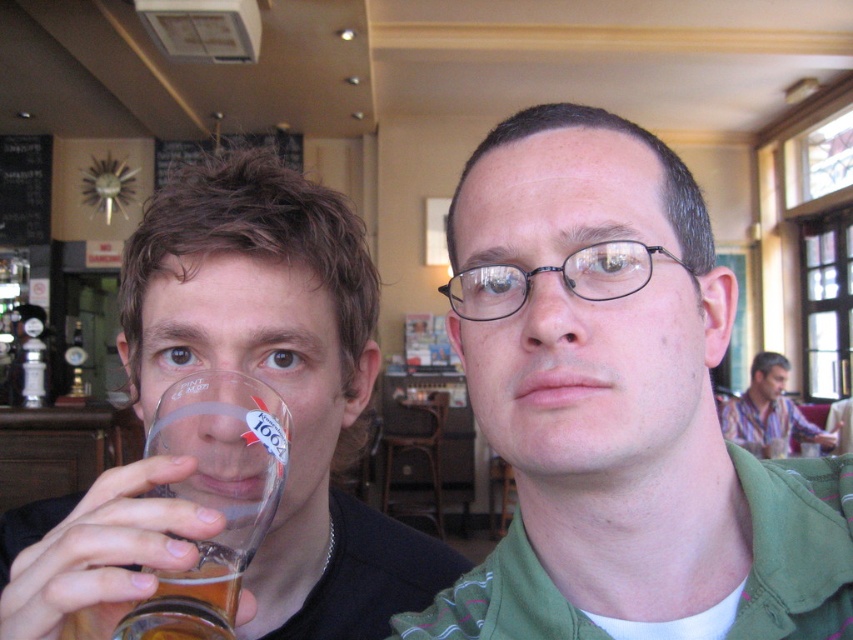
You are a delivery person who needs to place a small package between the clear glass beer at left and the clear glass beer glass at left. The package is 7 inches long. Can you fit it between them?

The clear glass beer at left and the clear glass beer glass at left are 6.95 inches apart from each other. The package is 7 inches long, so it won not fit between them as the distance is slightly less than the package length.

You are a tailor who needs to determine which shirt requires more fabric for alterations. Based on the image, which shirt between the green fabric shirt at center and the striped cotton shirt at right would need more fabric?

The striped cotton shirt at right requires more fabric since it is larger than the green fabric shirt at center.